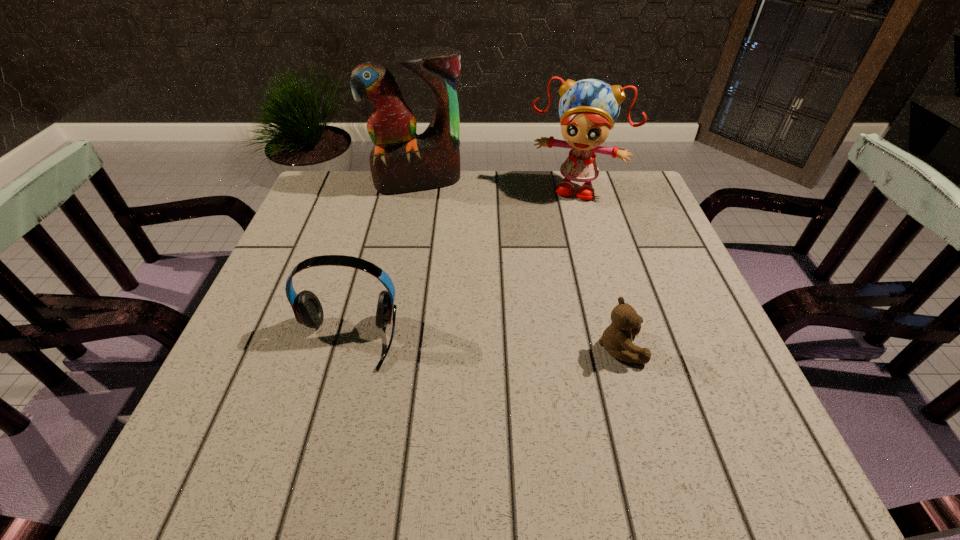
Identify the location of object at the near left corner. This screenshot has width=960, height=540. (308, 311).

The width and height of the screenshot is (960, 540). In order to click on object situated at the far right corner in this screenshot , I will do `click(588, 109)`.

In the image, there is a desktop. Where is `vacant area at the far edge`? vacant area at the far edge is located at coordinates click(x=504, y=198).

In order to click on vacant position at the near edge of the desktop in this screenshot , I will do `click(480, 409)`.

This screenshot has width=960, height=540. In the image, there is a desktop. What are the coordinates of `blank space at the left edge` in the screenshot? It's located at (335, 285).

The height and width of the screenshot is (540, 960). In order to click on vacant area at the right edge of the desktop in this screenshot , I will do `click(639, 288)`.

Locate an element on the screen. This screenshot has height=540, width=960. vacant space at the far left corner is located at coordinates (330, 215).

The image size is (960, 540). I want to click on vacant area at the far right corner of the desktop, so click(654, 207).

The image size is (960, 540). I want to click on free space between the shortest object and the tallest object, so click(x=519, y=265).

This screenshot has height=540, width=960. What are the coordinates of `unoccupied position between the teddy bear and the third shortest object` in the screenshot? It's located at (598, 267).